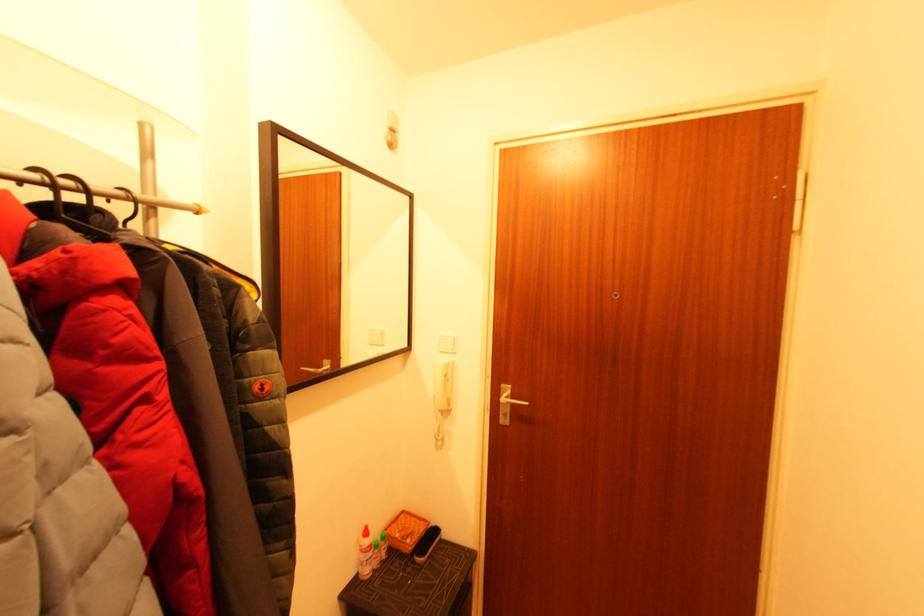
This screenshot has height=616, width=924. I want to click on small orange basket, so click(x=406, y=531).